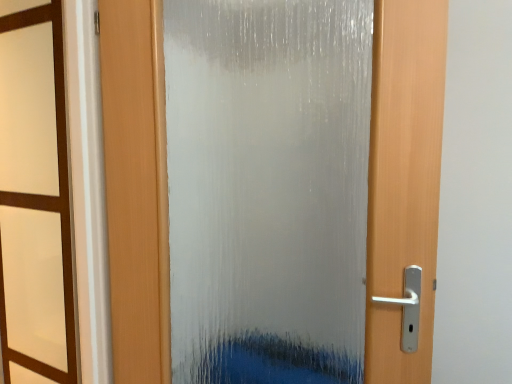
Question: Is brown wood window frame at left aimed at frosted glass door at center?

Choices:
 (A) no
 (B) yes

Answer: (A)

Question: Would you say frosted glass door at center is part of brown wood window frame at left's contents?

Choices:
 (A) no
 (B) yes

Answer: (A)

Question: Can you confirm if brown wood window frame at left is bigger than frosted glass door at center?

Choices:
 (A) yes
 (B) no

Answer: (B)

Question: From the image's perspective, is brown wood window frame at left on top of frosted glass door at center?

Choices:
 (A) yes
 (B) no

Answer: (B)

Question: Is brown wood window frame at left wider than frosted glass door at center?

Choices:
 (A) yes
 (B) no

Answer: (B)

Question: Does brown wood window frame at left lie in front of frosted glass door at center?

Choices:
 (A) yes
 (B) no

Answer: (A)

Question: Is frosted glass door at center to the right of brown wood window frame at left from the viewer's perspective?

Choices:
 (A) no
 (B) yes

Answer: (B)

Question: Are frosted glass door at center and brown wood window frame at left located far from each other?

Choices:
 (A) yes
 (B) no

Answer: (B)

Question: From the image's perspective, is frosted glass door at center located beneath brown wood window frame at left?

Choices:
 (A) yes
 (B) no

Answer: (B)

Question: Can you confirm if frosted glass door at center is positioned to the left of brown wood window frame at left?

Choices:
 (A) yes
 (B) no

Answer: (B)

Question: Is frosted glass door at center next to brown wood window frame at left and touching it?

Choices:
 (A) yes
 (B) no

Answer: (B)

Question: From a real-world perspective, is frosted glass door at center on brown wood window frame at left?

Choices:
 (A) yes
 (B) no

Answer: (B)

Question: From the image's perspective, is brown wood window frame at left positioned above or below frosted glass door at center?

Choices:
 (A) above
 (B) below

Answer: (B)